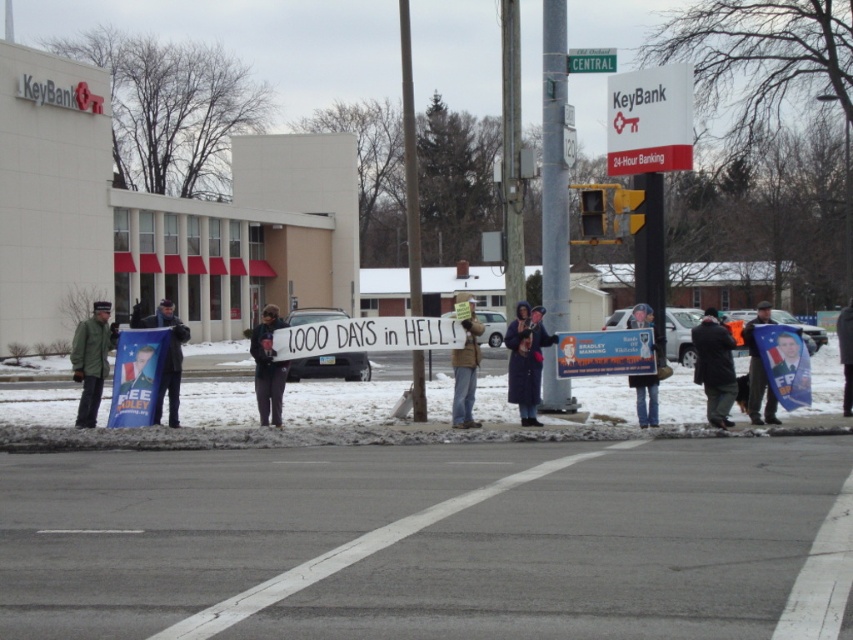
You are a photographer standing at the protest scene. You want to take a photo that includes both the metallic silver poster at center and the matte blue banner at left. Which object should you focus on first to ensure both are in frame?

You should focus on the metallic silver poster at center first because it is closer to you than the matte blue banner at left, so adjusting the camera to include both would require ensuring the closer object is centered before framing the background element.

In the protest scene near the KeyBank branch, you notice a dark gray fabric jacket at lower right and a brown paper bag at center. Which object is positioned to the right of the other?

The dark gray fabric jacket at lower right is to the right of the brown paper bag at center.

You are a photographer standing at the center of the street. You want to take a photo that includes the dark gray fabric jacket at lower right. Where should you position yourself to capture the jacket in the frame?

To capture the dark gray fabric jacket at lower right in your photo, position yourself so that the jacket is at the lower right of your frame, corresponding to the coordinates point (714, 368).